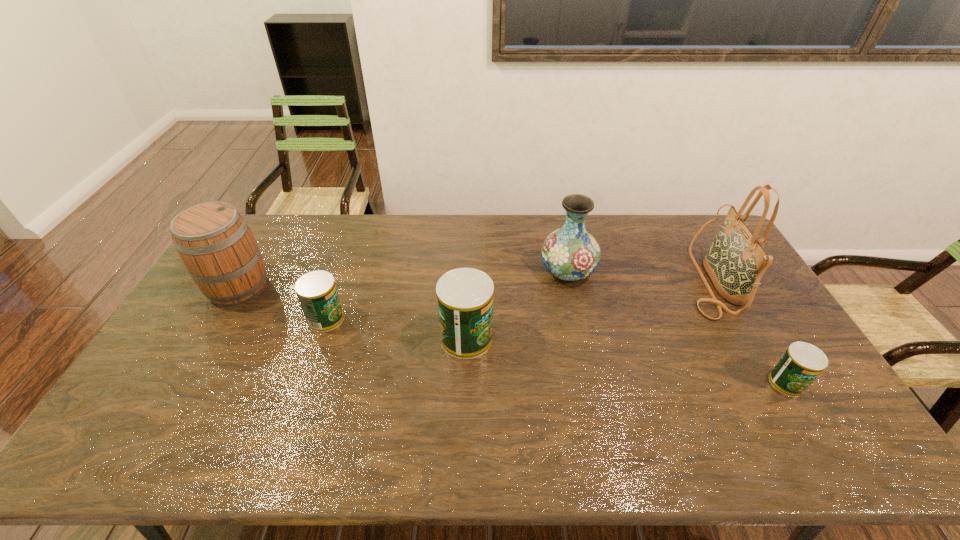
Please point a location where one more can can be added evenly. Please provide its 2D coordinates. Your answer should be formatted as a tuple, i.e. [(x, y)], where the tuple contains the x and y coordinates of a point satisfying the conditions above.

[(619, 359)]